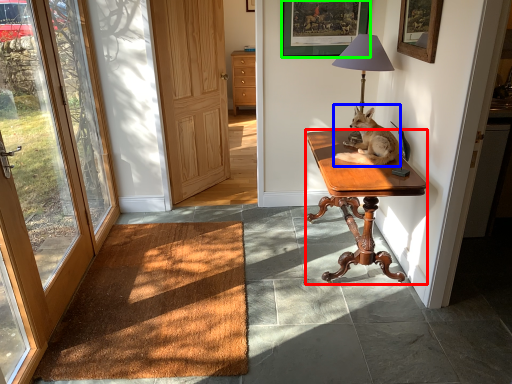
Question: Which object is positioned closest to desk (highlighted by a red box)? Select from dog (highlighted by a blue box) and picture frame (highlighted by a green box).

Choices:
 (A) dog
 (B) picture frame

Answer: (A)